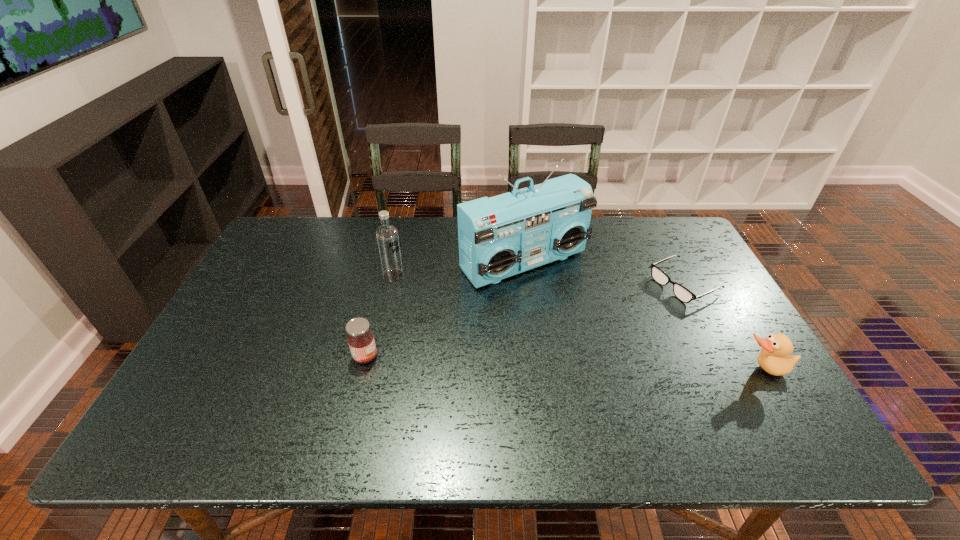
This screenshot has height=540, width=960. In order to click on vacant space on the desktop that is between the jam and the duck and is positioned on the front label of the vodka in this screenshot , I will do `click(549, 363)`.

This screenshot has height=540, width=960. I want to click on free spot on the desktop that is between the jam and the duck and is positioned on the front-facing side of the third object from left to right, so click(x=621, y=365).

Locate an element on the screen. vacant spot on the desktop that is between the jam and the duck and is positioned on the front-facing side of the spectacles is located at coordinates (516, 362).